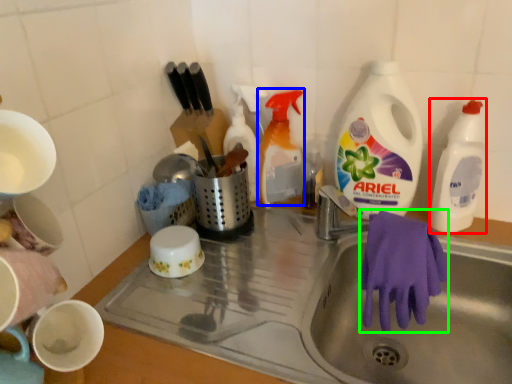
Question: Which object is positioned closest to cleaning product (highlighted by a red box)? Select from cleaning product (highlighted by a blue box) and glove (highlighted by a green box).

Choices:
 (A) cleaning product
 (B) glove

Answer: (B)